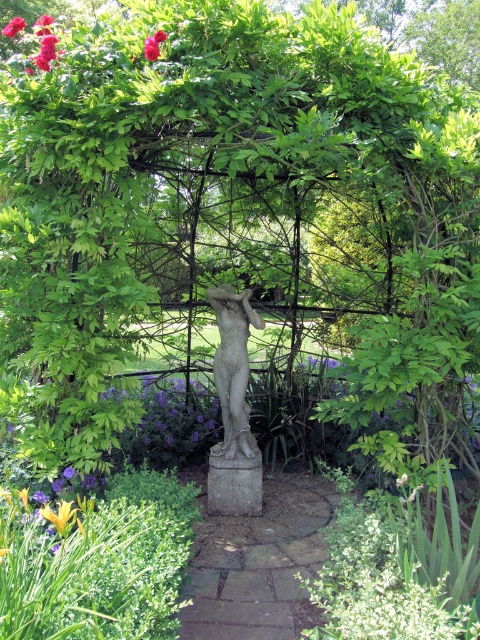
You are standing in the garden and looking at the arbor. There are two points marked in the image. The first point is at coordinate (332, 493) and the second is at (22, 24). Which point is closer to you?

Point (22, 24) is closer to you because it is less further to the camera than point (332, 493).

From the picture: You are a gardener looking at the garden scene. You see the bright pink petals at upper left and the red matte flower at upper left. Which one is nearer to you?

The bright pink petals at upper left are closer to the viewer than the red matte flower at upper left.